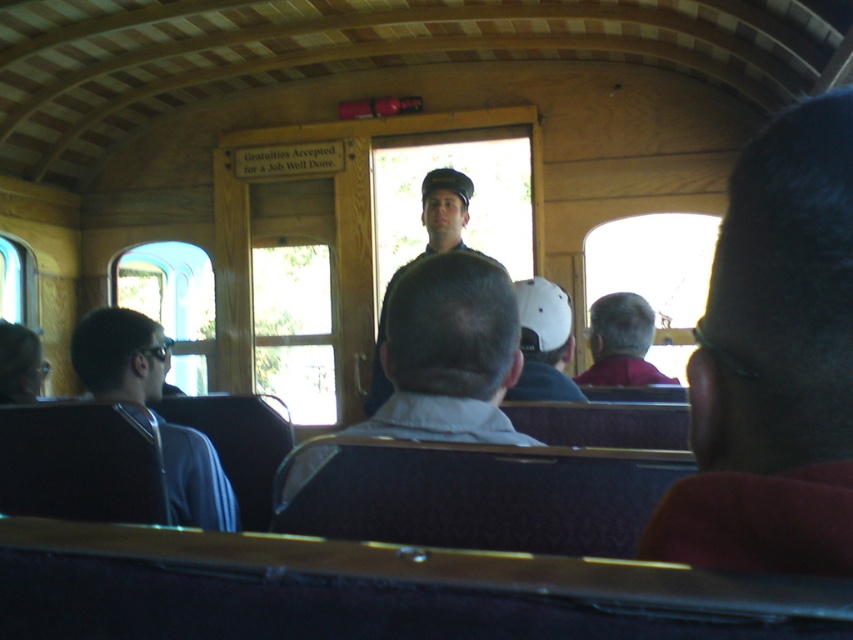
Based on the photo, you are a passenger sitting at the back of the vintage train car. You notice a blue fabric jacket at left and a uniformed man at center. Which object is closer to the front of the train car?

The uniformed man at center is closer to the front of the train car because the blue fabric jacket at left is to the left of the uniformed man at center, meaning the uniformed man is positioned between the jacket and the front of the train car.

Based on the photo, you are a tour guide standing at the back of the train car. You need to hand out a map to the passenger wearing the light brown leather jacket at center and the passenger with gray hair at center. If your reach is 4 feet, can you hand both maps without moving closer?

The distance between the light brown leather jacket at center and gray hair at center is 5.04 feet. Since your reach is only 4 feet, you cannot reach both passengers at once without moving closer.